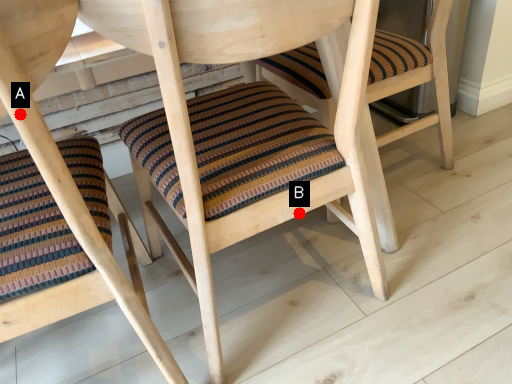
Question: Two points are circled on the image, labeled by A and B beside each circle. Which of the following is the closest to the observer?

Choices:
 (A) A is closer
 (B) B is closer

Answer: (A)